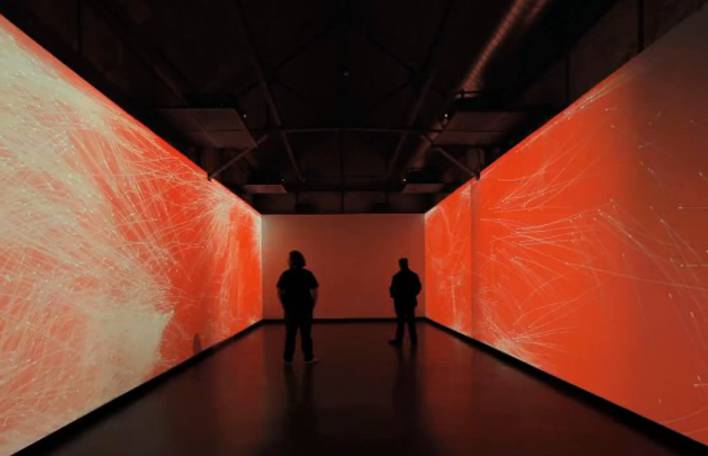
Identify the location of ceiling. (316, 112).